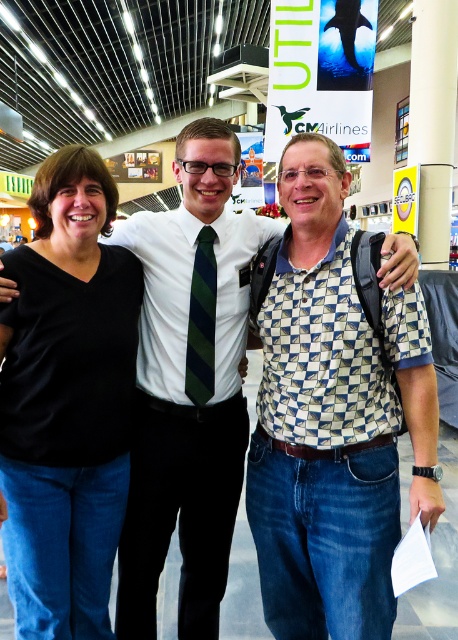
Which is more to the right, black matte shirt at left or green striped tie at center?

From the viewer's perspective, green striped tie at center appears more on the right side.

Can you confirm if black matte shirt at left is bigger than green striped tie at center?

Correct, black matte shirt at left is larger in size than green striped tie at center.

Between point (16, 524) and point (216, 291), which one is positioned in front?

Positioned in front is point (16, 524).

Find the location of `black matte shirt at left`. black matte shirt at left is located at coordinates (66, 401).

How far apart are checkered fabric shirt at center and green striped tie at center?

checkered fabric shirt at center and green striped tie at center are 18.44 inches apart from each other.

This screenshot has width=458, height=640. Describe the element at coordinates (333, 419) in the screenshot. I see `checkered fabric shirt at center` at that location.

Image resolution: width=458 pixels, height=640 pixels. In order to click on checkered fabric shirt at center in this screenshot , I will do `click(333, 419)`.

Can you confirm if checkered fabric shirt at center is wider than black matte shirt at left?

Indeed, checkered fabric shirt at center has a greater width compared to black matte shirt at left.

Between checkered fabric shirt at center and black matte shirt at left, which one is positioned lower?

checkered fabric shirt at center is below.

This screenshot has width=458, height=640. In order to click on checkered fabric shirt at center in this screenshot , I will do `click(333, 419)`.